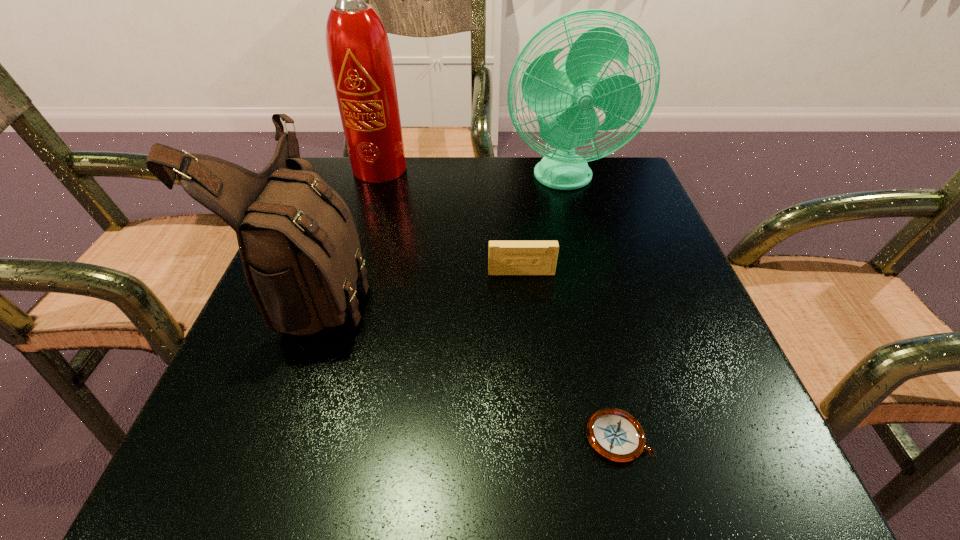
Identify the location of object at the near right corner. (614, 434).

Identify the location of vacant space at the far edge. (420, 207).

Identify the location of vacant space at the near edge of the desktop. The height and width of the screenshot is (540, 960). (420, 456).

Where is `free spot at the left edge of the desktop`? The width and height of the screenshot is (960, 540). free spot at the left edge of the desktop is located at coordinates (311, 372).

You are a GUI agent. You are given a task and a screenshot of the screen. Output one action in this format:
    pyautogui.click(x=<x>, y=<y>)
    Task: Click on the blank space at the right edge of the desktop
    This screenshot has width=960, height=540.
    Given the screenshot: What is the action you would take?
    pyautogui.click(x=609, y=251)

The height and width of the screenshot is (540, 960). I want to click on vacant space at the far right corner of the desktop, so click(x=592, y=212).

Locate an element on the screen. The width and height of the screenshot is (960, 540). free spot at the near right corner of the desktop is located at coordinates (747, 479).

I want to click on free space that is in between the second shortest object and the shortest object, so click(569, 355).

The image size is (960, 540). Identify the location of free space between the fire extinguisher and the second shortest object. (452, 221).

What are the coordinates of `vacant space that's between the fire extinguisher and the shortest object` in the screenshot? It's located at (501, 303).